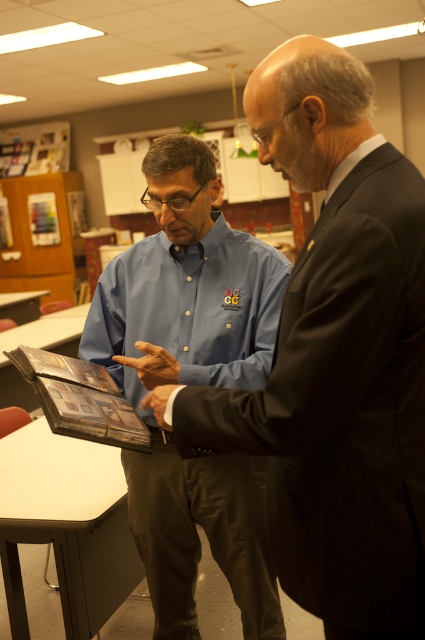
Locate an element on the screen. The width and height of the screenshot is (425, 640). blue shirt at center is located at coordinates (337, 356).

Can you confirm if blue shirt at center is positioned to the left of white glossy table at lower left?

No, blue shirt at center is not to the left of white glossy table at lower left.

Find the location of a particular element. The width and height of the screenshot is (425, 640). blue shirt at center is located at coordinates (337, 356).

Is blue cotton shirt at center shorter than white glossy table at lower left?

In fact, blue cotton shirt at center may be taller than white glossy table at lower left.

Based on the photo, is blue cotton shirt at center further to camera compared to white glossy table at lower left?

That is False.

The height and width of the screenshot is (640, 425). Describe the element at coordinates (186, 288) in the screenshot. I see `blue cotton shirt at center` at that location.

At what (x,y) coordinates should I click in order to perform the action: click on blue cotton shirt at center. Please return your answer as a coordinate pair (x, y). The height and width of the screenshot is (640, 425). Looking at the image, I should click on (186, 288).

Is blue shirt at center wider than blue cotton shirt at center?

In fact, blue shirt at center might be narrower than blue cotton shirt at center.

Which is behind, point (331, 600) or point (218, 483)?

The point (218, 483) is more distant.

Locate an element on the screen. Image resolution: width=425 pixels, height=640 pixels. blue shirt at center is located at coordinates (337, 356).

Where is `blue shirt at center`? This screenshot has height=640, width=425. blue shirt at center is located at coordinates (337, 356).